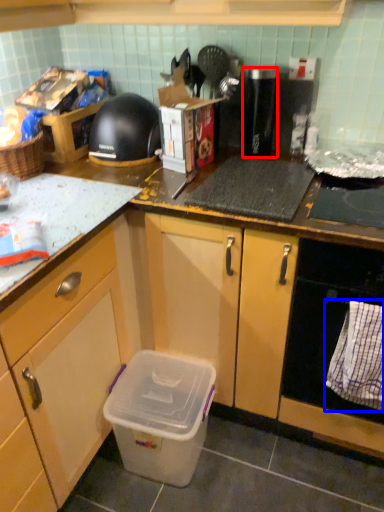
Question: Which point is further to the camera, appliance (highlighted by a red box) or cloth (highlighted by a blue box)?

Choices:
 (A) appliance
 (B) cloth

Answer: (A)